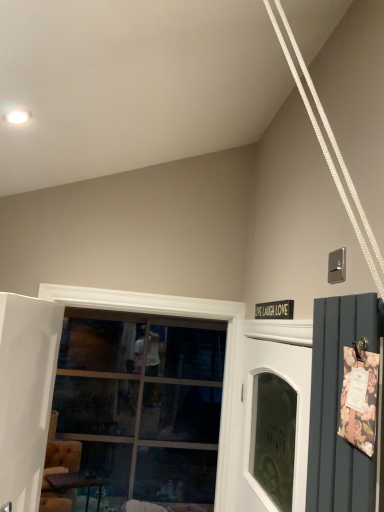
Question: Would you say clear glass window at center is inside or outside white glass door at center?

Choices:
 (A) inside
 (B) outside

Answer: (B)

Question: Is point (158, 385) positioned closer to the camera than point (273, 355)?

Choices:
 (A) closer
 (B) farther

Answer: (B)

Question: Estimate the real-world distances between objects in this image. Which object is farther from the white glass door at center?

Choices:
 (A) clear glass window at center
 (B) white glossy door at left
 (C) wooden table at lower left

Answer: (A)

Question: Which object is the closest to the white glossy door at left?

Choices:
 (A) clear glass window at center
 (B) wooden table at lower left
 (C) white glass door at center

Answer: (C)